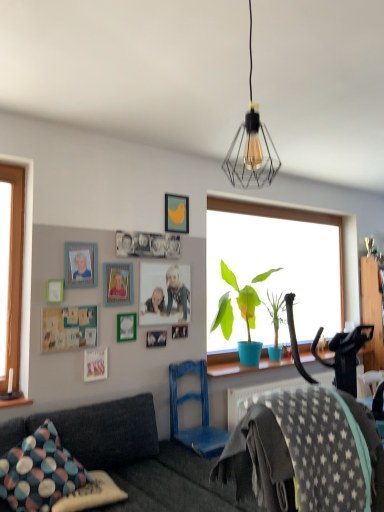
This screenshot has height=512, width=384. In order to click on wooden photo frame at center, placed as the 8th picture frame when sorted from top to bottom in this screenshot , I will do `click(179, 331)`.

At what (x,y) coordinates should I click in order to perform the action: click on gray star-patterned fabric at lower right. Please return your answer as a coordinate pair (x, y). Looking at the image, I should click on (306, 452).

The width and height of the screenshot is (384, 512). What do you see at coordinates (95, 364) in the screenshot?
I see `matte wooden picture frame at upper center, positioned as the tenth picture frame in top-to-bottom order` at bounding box center [95, 364].

Based on the photo, what is the approximate height of dark gray fabric couch at lower left?

dark gray fabric couch at lower left is 34.08 inches in height.

The image size is (384, 512). What are the coordinates of `white matte picture frame at upper left, arranged as the fourth picture frame when viewed from the top` in the screenshot? It's located at (54, 290).

Between yellow matte picture frame at upper center, which appears as the first picture frame when viewed from the top, and wooden picture frame at upper center, the third picture frame from the top, which one is positioned in front?

Positioned in front is wooden picture frame at upper center, the third picture frame from the top.

Is yellow matte picture frame at upper center, which appears as the first picture frame when viewed from the top, not near wooden picture frame at upper center, acting as the eighth picture frame starting from the bottom?

That's not correct — yellow matte picture frame at upper center, which appears as the first picture frame when viewed from the top, is a little close to wooden picture frame at upper center, acting as the eighth picture frame starting from the bottom.

Which point is more forward, (185, 197) or (130, 269)?

The point (130, 269) is closer to the camera.

Identify the location of the 2nd picture frame directly beneath the yellow matte picture frame at upper center, which is the tenth picture frame from bottom to top (from a real-world perspective). The width and height of the screenshot is (384, 512). (118, 284).

Is wooden photo frame at center, placed as the 8th picture frame when sorted from top to bottom, at the back of green matte picture frame at upper center, the 7th picture frame viewed from the top?

No.

Who is bigger, green matte picture frame at upper center, the 7th picture frame viewed from the top, or wooden photo frame at center, which is the 3th picture frame in bottom-to-top order?

With larger size is green matte picture frame at upper center, the 7th picture frame viewed from the top.

Which point is more forward, (x=127, y=322) or (x=183, y=328)?

The point (x=127, y=322) is in front.

From a real-world perspective, who is located lower, white matte picture frame at upper left, which is counted as the 7th picture frame, starting from the bottom, or wooden dresser at right?

From a 3D spatial view, wooden dresser at right is below.

Which object is closer to the camera taking this photo, white matte picture frame at upper left, arranged as the fourth picture frame when viewed from the top, or wooden dresser at right?

white matte picture frame at upper left, arranged as the fourth picture frame when viewed from the top, is in front.

Is point (63, 286) less distant than point (366, 306)?

Yes, it is.

Is wooden picture frame at upper center, acting as the eighth picture frame starting from the bottom, completely or partially outside of polka dot fabric pillow at lower left, arranged as the second pillow when viewed from the top?

Absolutely, wooden picture frame at upper center, acting as the eighth picture frame starting from the bottom, is external to polka dot fabric pillow at lower left, arranged as the second pillow when viewed from the top.

Between wooden picture frame at upper center, the third picture frame from the top, and polka dot fabric pillow at lower left, positioned as the 1th pillow in bottom-to-top order, which one has smaller width?

→ Thinner between the two is wooden picture frame at upper center, the third picture frame from the top.

From the image's perspective, between wooden picture frame at upper center, acting as the eighth picture frame starting from the bottom, and polka dot fabric pillow at lower left, positioned as the 1th pillow in bottom-to-top order, who is located below?

polka dot fabric pillow at lower left, positioned as the 1th pillow in bottom-to-top order, from the image's perspective.

Is wooden picture frame at upper center, acting as the eighth picture frame starting from the bottom, far away from polka dot fabric pillow at lower left, positioned as the 1th pillow in bottom-to-top order?

That's right, there is a large distance between wooden picture frame at upper center, acting as the eighth picture frame starting from the bottom, and polka dot fabric pillow at lower left, positioned as the 1th pillow in bottom-to-top order.

Which is in front, point (128, 474) or point (177, 334)?

The point (128, 474) is more forward.

Does dark gray fabric couch at lower left come in front of wooden photo frame at center, placed as the 8th picture frame when sorted from top to bottom?

Yes, dark gray fabric couch at lower left is closer to the viewer.

Is dark gray fabric couch at lower left at the right side of wooden photo frame at center, placed as the 8th picture frame when sorted from top to bottom?

In fact, dark gray fabric couch at lower left is to the left of wooden photo frame at center, placed as the 8th picture frame when sorted from top to bottom.

Is gray star-patterned fabric at lower right bigger or smaller than wooden photo frame at center, which is the 9th picture frame from top to bottom?

Clearly, gray star-patterned fabric at lower right is larger in size than wooden photo frame at center, which is the 9th picture frame from top to bottom.

From the image's perspective, is gray star-patterned fabric at lower right over wooden photo frame at center, which is counted as the second picture frame, starting from the bottom?

No, from the image's perspective, gray star-patterned fabric at lower right is not above wooden photo frame at center, which is counted as the second picture frame, starting from the bottom.

Is gray star-patterned fabric at lower right touching wooden photo frame at center, which is the 9th picture frame from top to bottom?

gray star-patterned fabric at lower right and wooden photo frame at center, which is the 9th picture frame from top to bottom, are clearly separated.

Does blue matte plant pot at window contain polka dot fabric pillow at lower left, positioned as the 1th pillow in bottom-to-top order?

Actually, polka dot fabric pillow at lower left, positioned as the 1th pillow in bottom-to-top order, is outside blue matte plant pot at window.

From the picture: From a real-world perspective, is blue matte plant pot at window under polka dot fabric pillow at lower left, positioned as the 1th pillow in bottom-to-top order?

Actually, blue matte plant pot at window is physically above polka dot fabric pillow at lower left, positioned as the 1th pillow in bottom-to-top order, in the real world.

Consider the image. Can you confirm if blue matte plant pot at window is wider than polka dot fabric pillow at lower left, positioned as the 1th pillow in bottom-to-top order?

Correct, the width of blue matte plant pot at window exceeds that of polka dot fabric pillow at lower left, positioned as the 1th pillow in bottom-to-top order.

Can you tell me how much blue matte plant pot at window and polka dot fabric pillow at lower left, arranged as the second pillow when viewed from the top, differ in facing direction?

There is a 6.15-degree angle between the facing directions of blue matte plant pot at window and polka dot fabric pillow at lower left, arranged as the second pillow when viewed from the top.

There is a wooden picture frame at upper center, the third picture frame from the top. Identify the location of the 2nd picture frame above it (from the image's perspective). This screenshot has width=384, height=512. (176, 213).

Locate an element on the screen. picture frame that is the 3rd object located in front of the wooden photo frame at center, which is the 3th picture frame in bottom-to-top order is located at coordinates [126, 327].

Estimate the real-world distances between objects in this image. Which object is closer to matte plastic picture frame at upper left, arranged as the second picture frame when viewed from the top, wooden picture frame at upper center, acting as the eighth picture frame starting from the bottom, or multicolored fabric pillow at lower left, arranged as the second pillow when ordered from the bottom?

The object closer to matte plastic picture frame at upper left, arranged as the second picture frame when viewed from the top, is wooden picture frame at upper center, acting as the eighth picture frame starting from the bottom.

Estimate the real-world distances between objects in this image. Which object is closer to wooden photo frame at center, which is counted as the second picture frame, starting from the bottom, blue matte plant pot at window or blue painted wood swivel chair at lower center?

Based on the image, blue painted wood swivel chair at lower center appears to be nearer to wooden photo frame at center, which is counted as the second picture frame, starting from the bottom.

Looking at the image, which one is located further to matte wooden photo frame at center, placed as the 5th picture frame when sorted from top to bottom, polka dot fabric pillow at lower left, positioned as the 1th pillow in bottom-to-top order, or dark gray fabric couch at lower left?

polka dot fabric pillow at lower left, positioned as the 1th pillow in bottom-to-top order, lies further to matte wooden photo frame at center, placed as the 5th picture frame when sorted from top to bottom, than the other object.

Based on their spatial positions, is green matte picture frame at upper center, acting as the fourth picture frame starting from the bottom, or wooden picture frame at upper center, acting as the eighth picture frame starting from the bottom, further from multicolored fabric pillow at lower left, arranged as the second pillow when ordered from the bottom?

wooden picture frame at upper center, acting as the eighth picture frame starting from the bottom, lies further to multicolored fabric pillow at lower left, arranged as the second pillow when ordered from the bottom, than the other object.

Considering their positions, is matte black wire cage at upper center positioned further to wooden picture frame at upper center, the third picture frame from the top, than polka dot fabric pillow at lower left, arranged as the second pillow when viewed from the top?

matte black wire cage at upper center lies further to wooden picture frame at upper center, the third picture frame from the top, than the other object.

Looking at the image, which one is located closer to wooden picture frame at upper center, acting as the eighth picture frame starting from the bottom, matte wooden picture frame at upper center, the 1th picture frame in the bottom-to-top sequence, or wooden dresser at right?

The object closer to wooden picture frame at upper center, acting as the eighth picture frame starting from the bottom, is matte wooden picture frame at upper center, the 1th picture frame in the bottom-to-top sequence.

When comparing their distances from polka dot fabric pillow at lower left, arranged as the second pillow when viewed from the top, does wooden dresser at right or yellow matte picture frame at upper center, which is the tenth picture frame from bottom to top, seem further?

Among the two, wooden dresser at right is located further to polka dot fabric pillow at lower left, arranged as the second pillow when viewed from the top.

Considering their positions, is yellow matte picture frame at upper center, which is the tenth picture frame from bottom to top, positioned closer to dark gray fabric couch at lower left than white matte picture frame at upper left, arranged as the fourth picture frame when viewed from the top?

Among the two, white matte picture frame at upper left, arranged as the fourth picture frame when viewed from the top, is located nearer to dark gray fabric couch at lower left.

Where is `picture frame positioned between dark gray fabric couch at lower left and white matte picture frame at upper left, which is counted as the 7th picture frame, starting from the bottom, from near to far`? picture frame positioned between dark gray fabric couch at lower left and white matte picture frame at upper left, which is counted as the 7th picture frame, starting from the bottom, from near to far is located at coordinates click(x=69, y=328).

Where is `houseplant between matte plastic picture frame at upper left, positioned as the 9th picture frame in bottom-to-top order, and wooden dresser at right, in the horizontal direction`? The width and height of the screenshot is (384, 512). houseplant between matte plastic picture frame at upper left, positioned as the 9th picture frame in bottom-to-top order, and wooden dresser at right, in the horizontal direction is located at coordinates (247, 312).

The height and width of the screenshot is (512, 384). I want to click on swivel chair positioned between dark gray fabric couch at lower left and wooden photo frame at center, placed as the 8th picture frame when sorted from top to bottom, from near to far, so click(202, 413).

At what (x,y) coordinates should I click in order to perform the action: click on studio couch situated between polka dot fabric pillow at lower left, arranged as the second pillow when viewed from the top, and gray star-patterned fabric at lower right from left to right. Please return your answer as a coordinate pair (x, y). The height and width of the screenshot is (512, 384). Looking at the image, I should click on (133, 456).